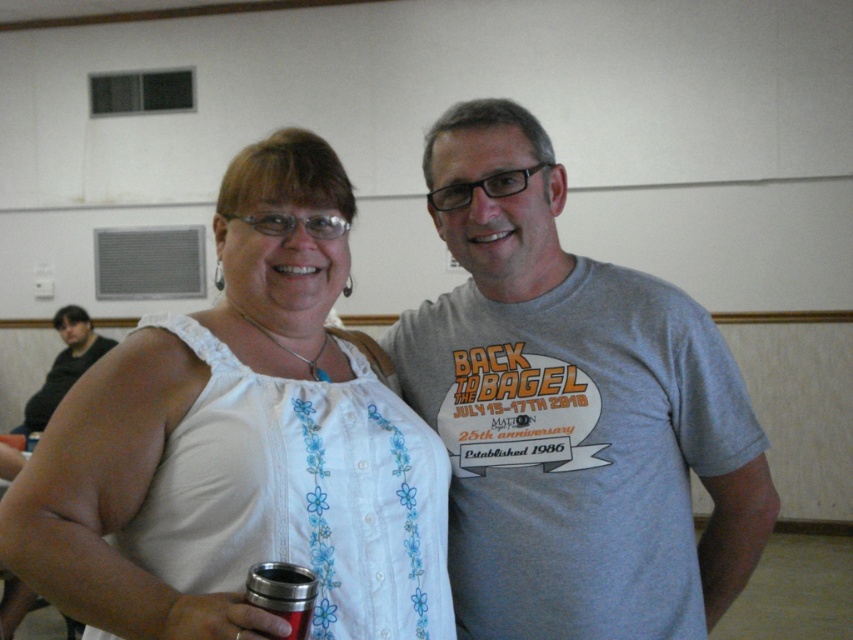
Question: Based on their relative distances, which object is nearer to the matte white tank top at center?

Choices:
 (A) white embroidered tank top at center
 (B) gray cotton t-shirt at center
 (C) brushed metal cup at lower left

Answer: (B)

Question: Observing the image, what is the correct spatial positioning of gray cotton t-shirt at center in reference to brushed metal cup at lower left?

Choices:
 (A) left
 (B) right

Answer: (B)

Question: Can you confirm if white embroidered tank top at center is positioned to the right of matte white tank top at center?

Choices:
 (A) no
 (B) yes

Answer: (B)

Question: Is white embroidered tank top at center closer to camera compared to gray cotton t-shirt at center?

Choices:
 (A) no
 (B) yes

Answer: (B)

Question: Which object appears closest to the camera in this image?

Choices:
 (A) brushed metal cup at lower left
 (B) white embroidered tank top at center

Answer: (B)

Question: Which point is farther to the camera?

Choices:
 (A) white embroidered tank top at center
 (B) matte white tank top at center

Answer: (B)